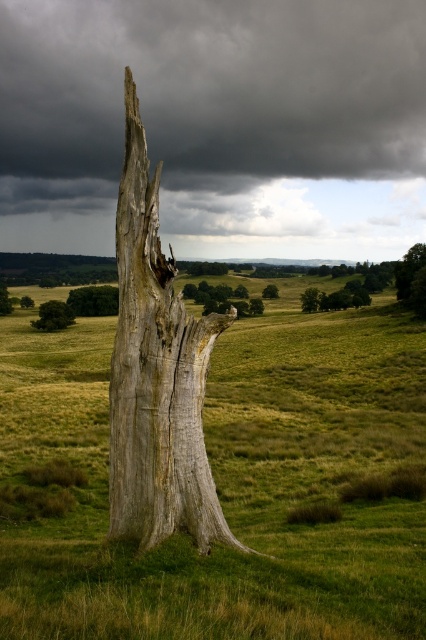
You are a hiker trying to navigate through the green grassy at center and the green leafy tree at upper right. Which direction should you go to reach the tree?

To reach the green leafy tree at upper right, you should go to the right from the green grassy at center since the grassy area is located to the left of the tree.

You are standing in the foreground of the landscape and want to reach the smooth gray tree trunk at center. Given its coordinates at point 0.467, 0.519, can you estimate its position relative to your current location?

The smooth gray tree trunk at center is located at coordinates (221, 298), which places it directly in front of you at the center of the scene. Since you are in the foreground, it is positioned slightly ahead and central in your field of view.